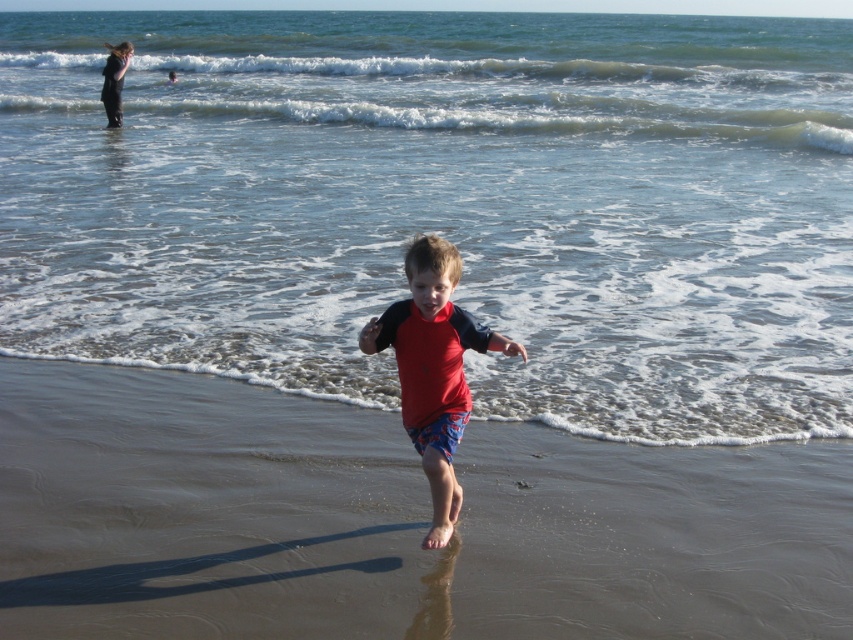
Is point (177, 429) more distant than point (106, 92)?

That is False.

Does point (86, 541) come behind point (103, 72)?

No, (86, 541) is in front of (103, 72).

Locate an element on the screen. This screenshot has width=853, height=640. red fabric shorts at center is located at coordinates (392, 522).

Which is more to the right, red matte swimsuit at center or black neoprene wetsuit at upper left?

red matte swimsuit at center is more to the right.

Is red matte swimsuit at center positioned behind black neoprene wetsuit at upper left?

No.

Which is behind, point (456, 520) or point (120, 122)?

The point (120, 122) is more distant.

In order to click on red matte swimsuit at center in this screenshot , I will do [433, 368].

Which of these two, red fabric shorts at center or red matte swimsuit at center, stands taller?

red matte swimsuit at center

Who is more distant from viewer, (177, 486) or (415, 349)?

Positioned behind is point (177, 486).

At what (x,y) coordinates should I click in order to perform the action: click on red fabric shorts at center. Please return your answer as a coordinate pair (x, y). The height and width of the screenshot is (640, 853). Looking at the image, I should click on click(392, 522).

The height and width of the screenshot is (640, 853). I want to click on red fabric shorts at center, so click(392, 522).